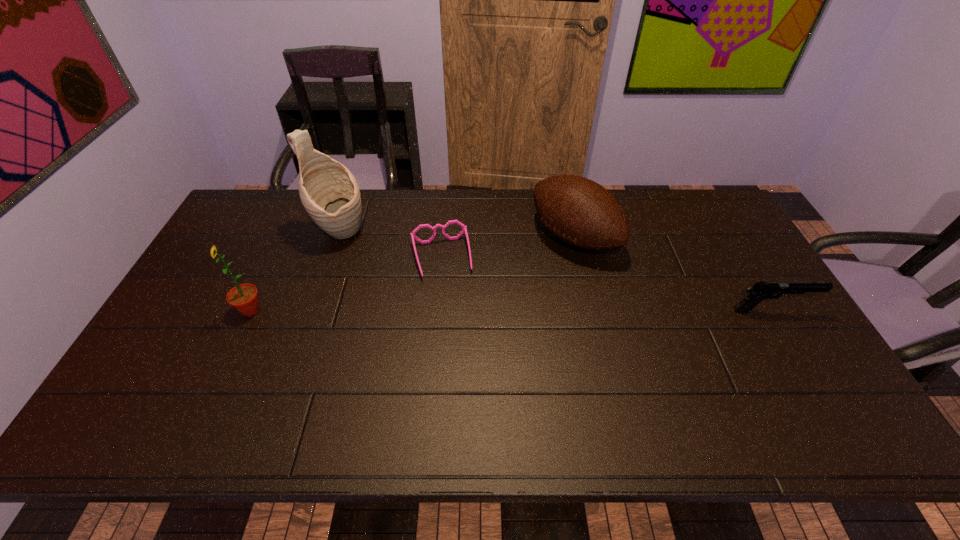
The width and height of the screenshot is (960, 540). I want to click on vacant space on the desktop that is between the leftmost object and the gun and is positioned on the arms of the spectacles, so click(x=452, y=310).

I want to click on vacant space on the desktop that is between the sunflower and the rightmost object and is positioned on the laces of the fourth object from left to right, so click(x=468, y=310).

Find the location of a particular element. The image size is (960, 540). vacant spot on the desktop that is between the sunflower and the gun and is positioned at the spout of the second object from left to right is located at coordinates (471, 310).